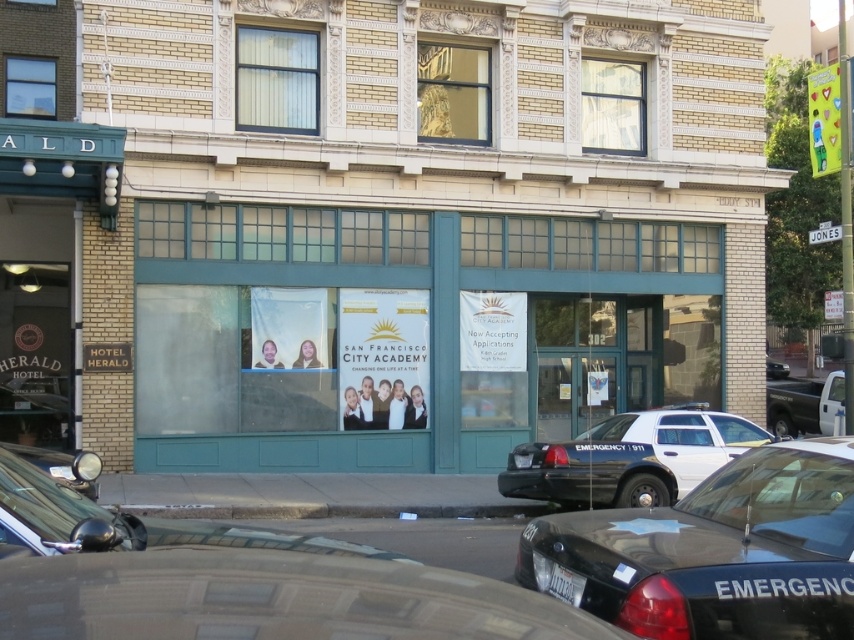
Is point (652, 508) less distant than point (776, 365)?

That is True.

Does black glossy emergency vehicle at lower center appear over black glossy sedan at right?

No, black glossy emergency vehicle at lower center is not above black glossy sedan at right.

Find the location of a particular element. black glossy emergency vehicle at lower center is located at coordinates (714, 552).

Between point (601, 456) and point (773, 372), which one is positioned in front?

Positioned in front is point (601, 456).

Based on the photo, which is below, black/white emergency vehicle at center or black glossy sedan at right?

black/white emergency vehicle at center is below.

Does point (693, 410) come behind point (776, 371)?

That is False.

The height and width of the screenshot is (640, 854). Find the location of `black/white emergency vehicle at center`. black/white emergency vehicle at center is located at coordinates (630, 458).

Between point (700, 541) and point (773, 426), which one is positioned in front?

Point (700, 541)

Is the position of black glossy emergency vehicle at lower center more distant than that of metallic silver truck at right?

That is False.

Measure the distance between black glossy emergency vehicle at lower center and camera.

black glossy emergency vehicle at lower center is 5.39 meters away from camera.

I want to click on black glossy emergency vehicle at lower center, so click(x=714, y=552).